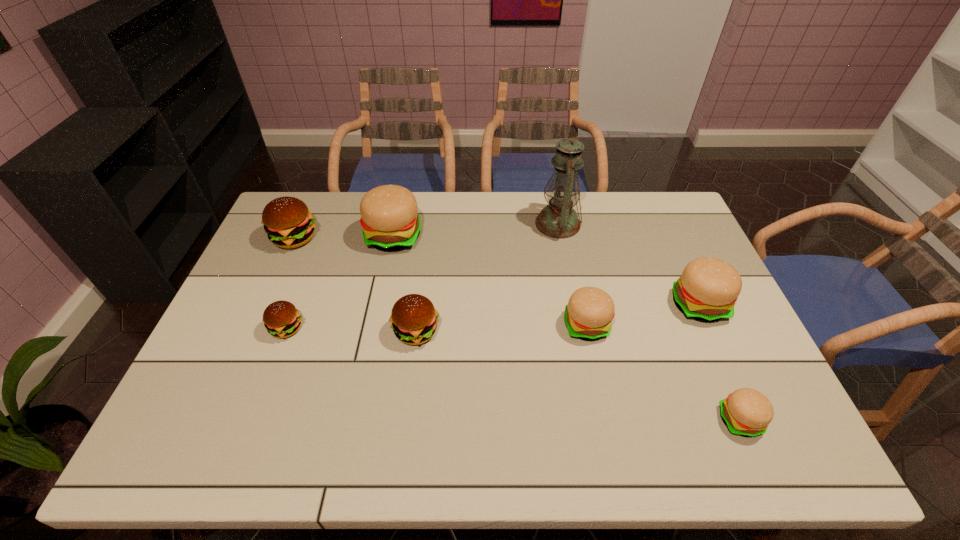
Identify the location of beige hamburger that is the fourth closest to the smallest brown hamburger. (747, 412).

Image resolution: width=960 pixels, height=540 pixels. What are the coordinates of `beige hamburger that is the third closest to the second biggest beige hamburger` in the screenshot? It's located at (389, 218).

Identify which brown hamburger is the third nearest to the second smallest beige hamburger. Please provide its 2D coordinates. Your answer should be formatted as a tuple, i.e. [(x, y)], where the tuple contains the x and y coordinates of a point satisfying the conditions above.

[(288, 223)]

The image size is (960, 540). What are the coordinates of `the second closest brown hamburger to the rightmost brown hamburger` in the screenshot? It's located at (288, 223).

At what (x,y) coordinates should I click in order to perform the action: click on free spot that satisfies the following two spatial constraints: 1. on the front side of the farthest brown hamburger; 2. on the right side of the second smallest beige hamburger. Please return your answer as a coordinate pair (x, y). Looking at the image, I should click on (255, 326).

Where is `free space in the image that satisfies the following two spatial constraints: 1. on the front side of the fifth hamburger from left to right; 2. on the right side of the oil lamp`? free space in the image that satisfies the following two spatial constraints: 1. on the front side of the fifth hamburger from left to right; 2. on the right side of the oil lamp is located at coordinates (577, 326).

This screenshot has height=540, width=960. What are the coordinates of `free point that satisfies the following two spatial constraints: 1. on the front side of the tallest object; 2. on the left side of the third smallest beige hamburger` in the screenshot? It's located at click(573, 305).

I want to click on free spot that satisfies the following two spatial constraints: 1. on the front side of the tallest object; 2. on the left side of the nearest hamburger, so click(595, 420).

This screenshot has height=540, width=960. Find the location of `vacant space that satisfies the following two spatial constraints: 1. on the back side of the third hamburger from right to left; 2. on the left side of the smallest brown hamburger`. vacant space that satisfies the following two spatial constraints: 1. on the back side of the third hamburger from right to left; 2. on the left side of the smallest brown hamburger is located at coordinates (288, 326).

Identify the location of free space that satisfies the following two spatial constraints: 1. on the back side of the farthest beige hamburger; 2. on the right side of the biggest brown hamburger. (296, 236).